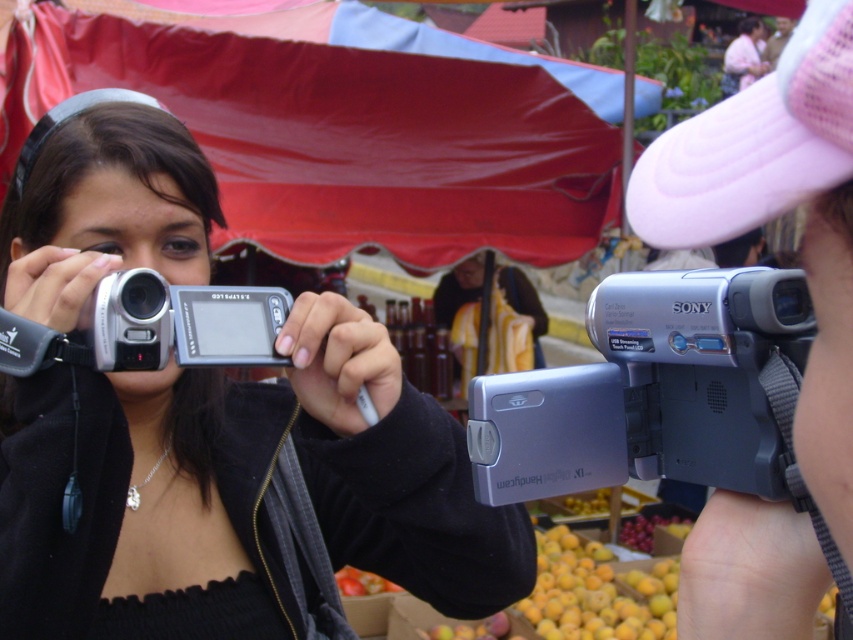
Is point (254, 612) closer to viewer compared to point (469, 397)?

No, (254, 612) is further to viewer.

Looking at this image, is silver metallic camera at center to the left of silver metallic video camera at center from the viewer's perspective?

Indeed, silver metallic camera at center is positioned on the left side of silver metallic video camera at center.

Locate an element on the screen. The height and width of the screenshot is (640, 853). silver metallic camera at center is located at coordinates (238, 492).

Is silver metallic camera at center wider than silver metallic camcorder at center?

Correct, the width of silver metallic camera at center exceeds that of silver metallic camcorder at center.

Is silver metallic camera at center smaller than silver metallic camcorder at center?

No.

Between point (363, 481) and point (827, 490), which one is positioned in front?

Positioned in front is point (827, 490).

Locate an element on the screen. This screenshot has height=640, width=853. silver metallic camera at center is located at coordinates (238, 492).

Can you confirm if silver metallic camera at center is shorter than red fabric canopy at upper center?

Yes.

Locate an element on the screen. The height and width of the screenshot is (640, 853). silver metallic camera at center is located at coordinates [238, 492].

Who is more forward, (44,392) or (125,61)?

Positioned in front is point (44,392).

Identify the location of silver metallic camera at center. (238, 492).